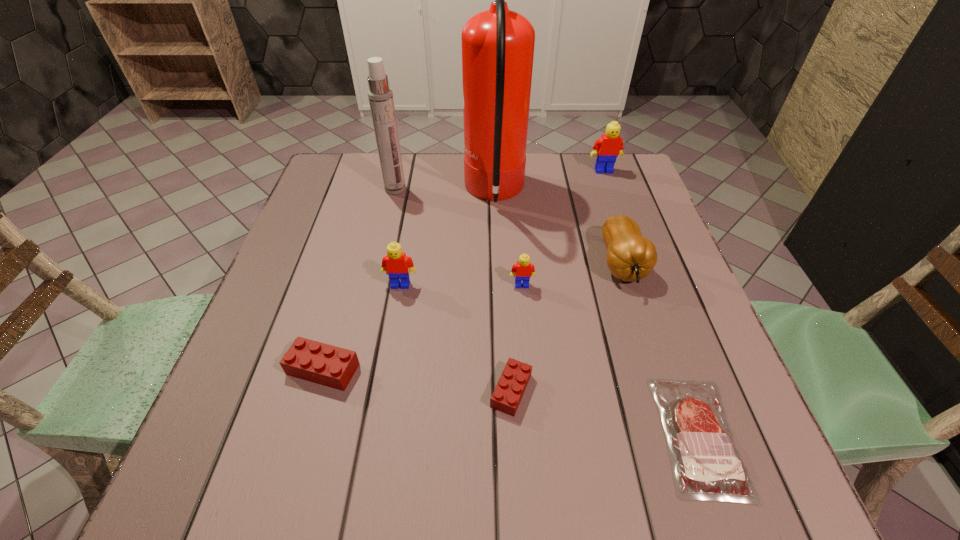
Identify the location of fire extinguisher. (497, 44).

Identify the location of the tallest object. Image resolution: width=960 pixels, height=540 pixels. (497, 44).

In order to click on the second tallest object in this screenshot , I will do `click(380, 95)`.

Locate an element on the screen. This screenshot has height=540, width=960. aerosol can is located at coordinates (380, 95).

This screenshot has width=960, height=540. Identify the location of the rightmost Lego. tap(607, 148).

Locate an element on the screen. This screenshot has width=960, height=540. the third tallest object is located at coordinates (607, 148).

At what (x,y) coordinates should I click in order to perform the action: click on the leftmost yellow Lego. Please return your answer as a coordinate pair (x, y). The width and height of the screenshot is (960, 540). Looking at the image, I should click on (396, 264).

Locate an element on the screen. Image resolution: width=960 pixels, height=540 pixels. the second tallest Lego is located at coordinates click(396, 264).

The height and width of the screenshot is (540, 960). Identify the location of gourd. (x=630, y=257).

You are a GUI agent. You are given a task and a screenshot of the screen. Output one action in this format:
    pyautogui.click(x=<x>, y=<y>)
    Task: Click on the second yellow Lego from right to left
    The width and height of the screenshot is (960, 540).
    Given the screenshot: What is the action you would take?
    pyautogui.click(x=522, y=270)